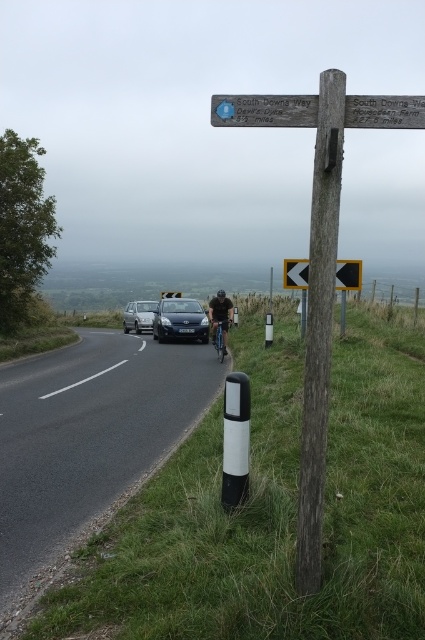
Question: Is yellow plastic arrow at center below blue metallic bicycle at center?

Choices:
 (A) yes
 (B) no

Answer: (B)

Question: Which point appears closest to the camera in this image?

Choices:
 (A) (220, 332)
 (B) (282, 109)
 (C) (159, 312)

Answer: (B)

Question: Can you confirm if wooden post at center is positioned below silver metallic car at center?

Choices:
 (A) yes
 (B) no

Answer: (A)

Question: Which point is farther to the camera?

Choices:
 (A) wooden signpost at upper center
 (B) yellow plastic arrow at center

Answer: (A)

Question: Which of the following is the farthest from the observer?

Choices:
 (A) (153, 316)
 (B) (357, 99)
 (C) (354, 262)
 (D) (217, 330)

Answer: (A)

Question: Is yellow plastic arrow at center to the left of blue metallic bicycle at center from the viewer's perspective?

Choices:
 (A) yes
 (B) no

Answer: (B)